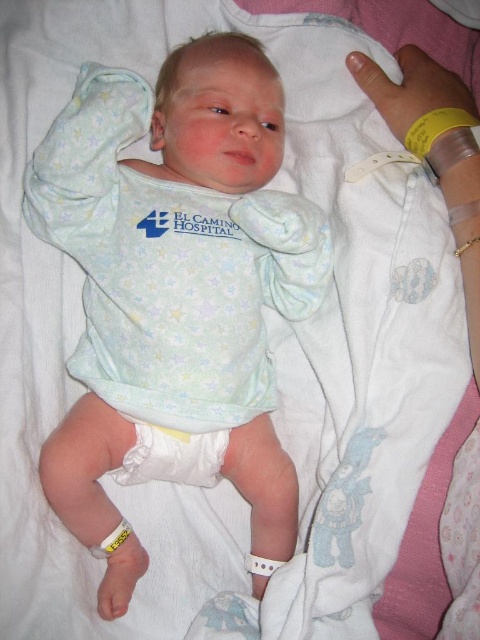
From the picture: In the scene described, where is the white soft fabric baby at center positioned relative to the white soft diaper at center?

The white soft fabric baby at center is to the right of the white soft diaper at center.

You are a nurse in a hospital nursery. You need to check the diaper of the baby lying on a white blanket. The baby is wearing a light green hospital gown. Where is the white soft diaper at center located in relation to the white soft fabric baby at center?

The white soft diaper at center is below the white soft fabric baby at center because the baby is lying on its back, so the diaper is positioned underneath the baby.

Based on the photo, you are a nurse in a hospital nursery. You need to place the white soft diaper at center onto the white soft fabric baby at center. Based on their sizes, will the diaper fit properly?

The white soft fabric baby at center is bigger than the white soft diaper at center, so the diaper may not fit properly as it is smaller than the baby.